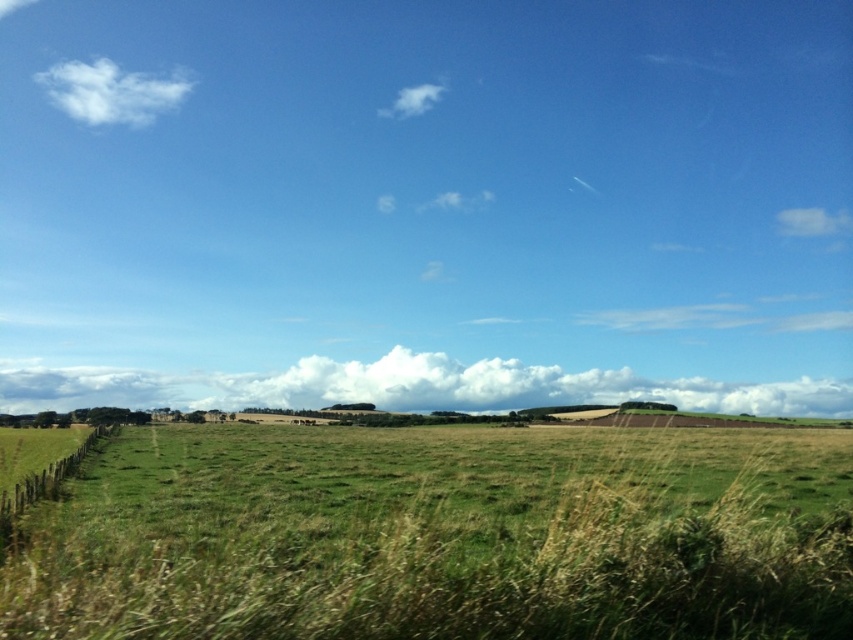
Looking at this image, you are a photographer planning to capture the entire green grassy field at center and white fluffy cloud at upper center in one shot. Based on the scene, which object would appear larger in the photo?

The green grassy field at center would appear larger in the photo because it has a larger size compared to the white fluffy cloud at upper center according to the description.

You are standing in the middle of the green grassy field at center and looking towards the white fluffy cloud at upper left. Which direction should you walk to get closer to the cloud?

Since the green grassy field at center is to the right of the white fluffy cloud at upper left, you should walk to your left to move towards the cloud.

You are standing in the middle of the pasture looking towards the wooden fence. There are two points marked in the image. Which point, point 1 at coordinates point (561,538) or point 2 at coordinates point (389,106), is closer to you?

Point 1 at coordinates point (561,538) is closer to the viewer than point 2 at coordinates point (389,106).